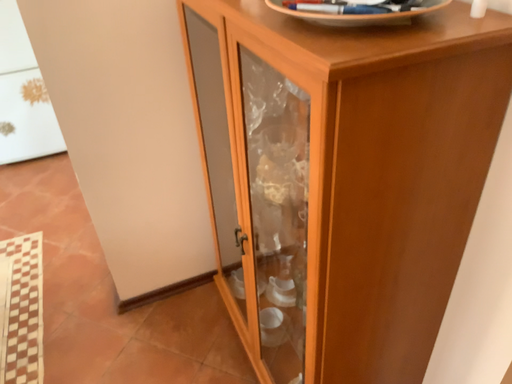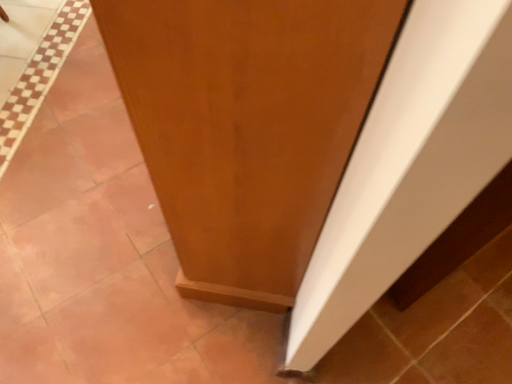
Question: How did the camera likely rotate when shooting the video?

Choices:
 (A) rotated right
 (B) rotated left

Answer: (B)